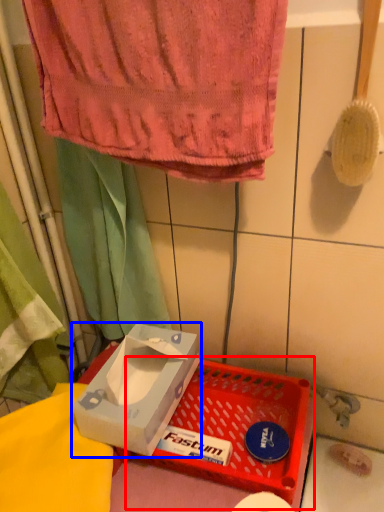
Question: Which object appears farthest to the camera in this image, basket (highlighted by a red box) or box (highlighted by a blue box)?

Choices:
 (A) basket
 (B) box

Answer: (B)